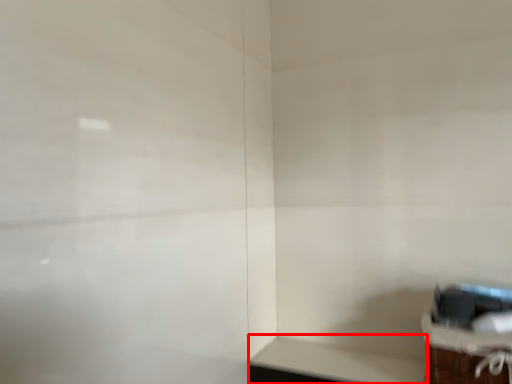
Question: From the image's perspective, what is the correct spatial relationship of table (annotated by the red box) in relation to furniture?

Choices:
 (A) below
 (B) above

Answer: (A)